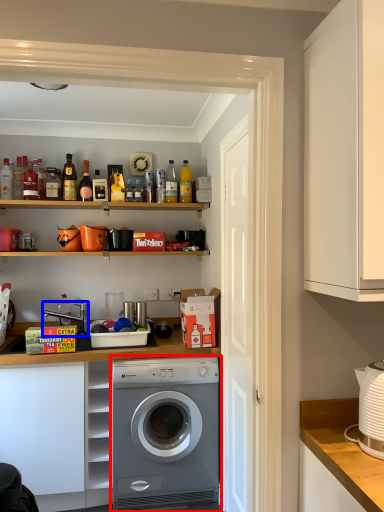
Question: Which object appears closest to the camera in this image, washing machine (highlighted by a red box) or sink (highlighted by a blue box)?

Choices:
 (A) washing machine
 (B) sink

Answer: (A)